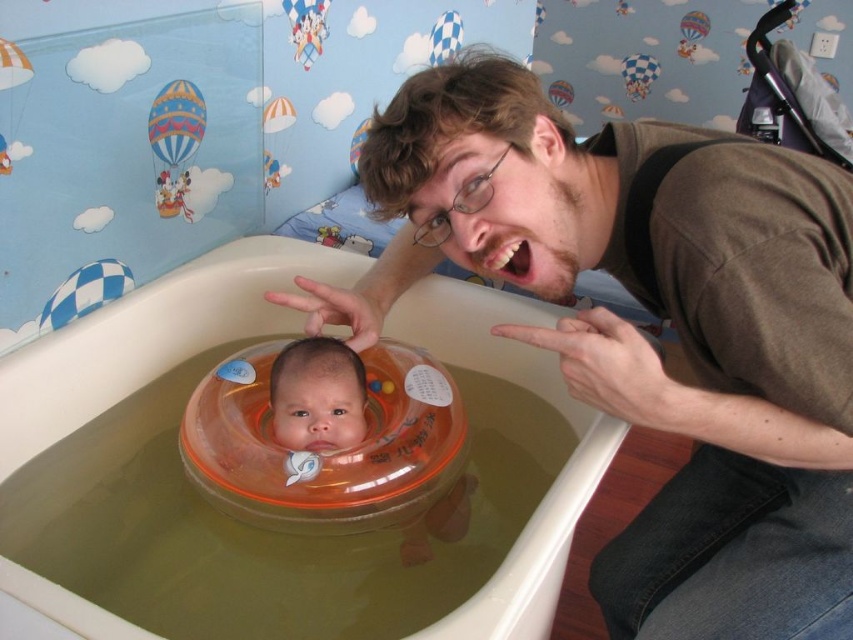
Question: Which point is closer to the camera?

Choices:
 (A) (701, 344)
 (B) (154, 124)

Answer: (A)

Question: Observing the image, what is the correct spatial positioning of translucent orange float at center in reference to multicolored fabric hot air balloon at upper left?

Choices:
 (A) below
 (B) above

Answer: (A)

Question: Can you confirm if brown cotton shirt at upper right is positioned above multicolored fabric hot air balloon at upper left?

Choices:
 (A) yes
 (B) no

Answer: (B)

Question: Can you confirm if smooth orange float at center is positioned to the left of multicolored fabric hot air balloon at upper left?

Choices:
 (A) yes
 (B) no

Answer: (B)

Question: Which object is the closest to the translucent orange float at center?

Choices:
 (A) multicolored fabric hot air balloon at upper left
 (B) brown cotton shirt at upper right
 (C) smooth orange float at center
 (D) blue checkered float at upper left

Answer: (B)

Question: Which of the following is the closest to the observer?

Choices:
 (A) blue checkered float at upper left
 (B) multicolored fabric hot air balloon at upper left
 (C) smooth orange float at center

Answer: (C)